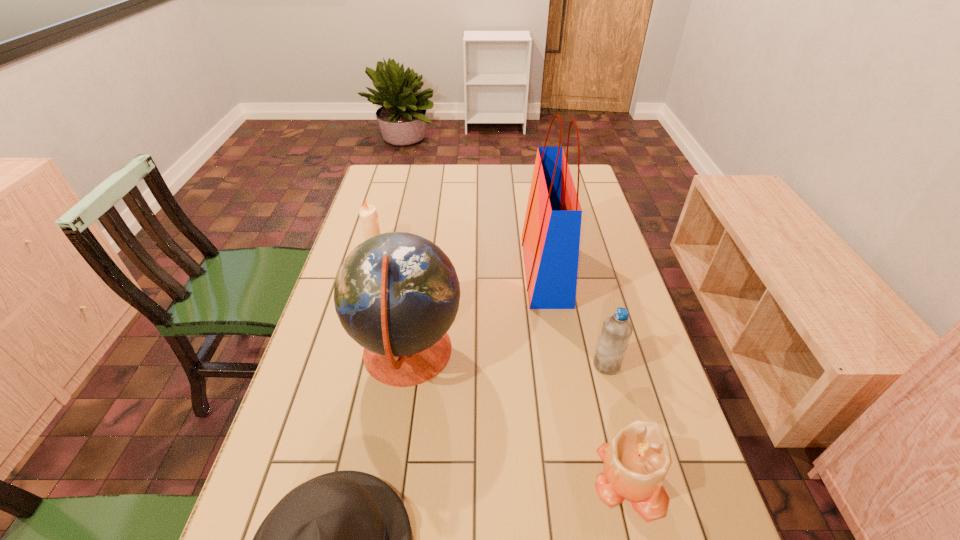
At what (x,y) coordinates should I click in order to perform the action: click on vacant space located on the front of the left candle. Please return your answer as a coordinate pair (x, y). The image size is (960, 540). Looking at the image, I should click on (358, 302).

Where is `vacant space located 0.180m on the back of the right candle`? vacant space located 0.180m on the back of the right candle is located at coordinates (602, 373).

At what (x,y) coordinates should I click in order to perform the action: click on globe at the left edge. Please return your answer as a coordinate pair (x, y). This screenshot has width=960, height=540. Looking at the image, I should click on (396, 294).

You are a GUI agent. You are given a task and a screenshot of the screen. Output one action in this format:
    pyautogui.click(x=<x>, y=<y>)
    Task: Click on the candle that is at the left edge
    The height and width of the screenshot is (540, 960).
    Given the screenshot: What is the action you would take?
    pyautogui.click(x=368, y=214)

Identify the location of water bottle that is at the right edge. The image size is (960, 540). (616, 331).

This screenshot has width=960, height=540. What are the coordinates of `candle at the right edge` in the screenshot? It's located at (636, 461).

You are a GUI agent. You are given a task and a screenshot of the screen. Output one action in this format:
    pyautogui.click(x=<x>, y=<y>)
    Task: Click on the free spot at the far edge of the desktop
    The width and height of the screenshot is (960, 540).
    Given the screenshot: What is the action you would take?
    pyautogui.click(x=510, y=167)

Where is `vacant area at the left edge`? The width and height of the screenshot is (960, 540). vacant area at the left edge is located at coordinates (350, 349).

Where is `vacant region at the right edge`? Image resolution: width=960 pixels, height=540 pixels. vacant region at the right edge is located at coordinates (602, 268).

Where is `free region at the far left corner of the desktop`? The width and height of the screenshot is (960, 540). free region at the far left corner of the desktop is located at coordinates (408, 167).